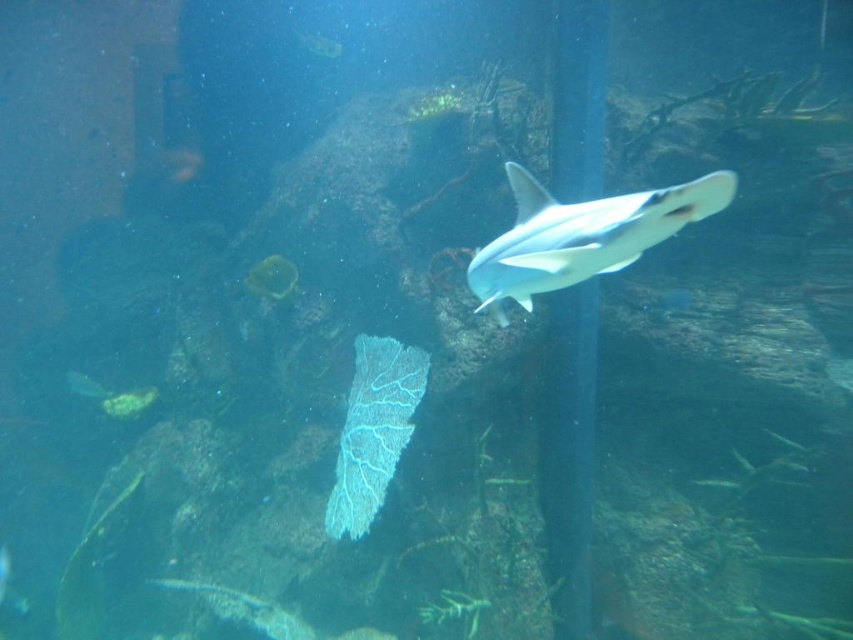
Question: Which of the following is the farthest from the observer?

Choices:
 (A) white smooth shark at center
 (B) white matte shark at center
 (C) translucent white shark at center

Answer: (C)

Question: Is white smooth shark at center further to camera compared to translucent white shark at center?

Choices:
 (A) yes
 (B) no

Answer: (B)

Question: Which object is closer to the camera taking this photo?

Choices:
 (A) translucent white shark at center
 (B) white smooth shark at center

Answer: (B)

Question: Is white smooth shark at center smaller than translucent white shark at center?

Choices:
 (A) yes
 (B) no

Answer: (B)

Question: Based on their relative distances, which object is farther from the white matte shark at center?

Choices:
 (A) translucent white shark at center
 (B) white smooth shark at center

Answer: (A)

Question: Is translucent white shark at center closer to camera compared to white matte shark at center?

Choices:
 (A) no
 (B) yes

Answer: (A)